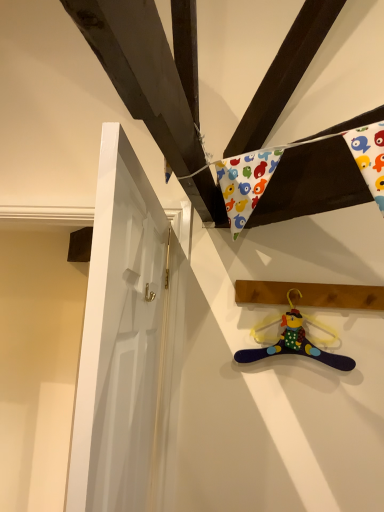
Measure the distance between multicolored fabric hanger at lower right and camera.

A distance of 4.79 feet exists between multicolored fabric hanger at lower right and camera.

At what (x,y) coordinates should I click in order to perform the action: click on multicolored fabric hanger at lower right. Please return your answer as a coordinate pair (x, y). Looking at the image, I should click on (267, 329).

Image resolution: width=384 pixels, height=512 pixels. Identify the location of wooden plank at upper right. (310, 294).

Between multicolored fabric hanger at lower right and multicolored fabric hanger at lower right, which one has less height?

multicolored fabric hanger at lower right.

Is multicolored fabric hanger at lower right a part of multicolored fabric hanger at lower right?

No, multicolored fabric hanger at lower right does not contain multicolored fabric hanger at lower right.

From a real-world perspective, between multicolored fabric hanger at lower right and multicolored fabric hanger at lower right, who is vertically higher?

From a 3D spatial view, multicolored fabric hanger at lower right is above.

Considering the positions of point (274, 322) and point (304, 348), is point (274, 322) closer or farther from the camera than point (304, 348)?

Point (274, 322) is positioned farther from the camera compared to point (304, 348).

Is multicolored fabric hanger at lower right located outside multicolored fabric hanger at lower right?

Yes, multicolored fabric hanger at lower right is outside of multicolored fabric hanger at lower right.

Does multicolored fabric hanger at lower right have a greater height compared to multicolored fabric hanger at lower right?

Incorrect, the height of multicolored fabric hanger at lower right is not larger of that of multicolored fabric hanger at lower right.

Is wooden plank at upper right located within multicolored fabric hanger at lower right?

No, wooden plank at upper right is not surrounded by multicolored fabric hanger at lower right.

Looking at this image, is multicolored fabric hanger at lower right touching wooden plank at upper right?

Yes, multicolored fabric hanger at lower right is in contact with wooden plank at upper right.

Considering the relative positions of multicolored fabric hanger at lower right and wooden plank at upper right in the image provided, is multicolored fabric hanger at lower right to the right of wooden plank at upper right from the viewer's perspective?

No.

Can you confirm if multicolored fabric hanger at lower right is positioned to the right of white glossy door at left?

Yes, multicolored fabric hanger at lower right is to the right of white glossy door at left.

Which object is closer to the camera taking this photo, multicolored fabric hanger at lower right or white glossy door at left?

white glossy door at left.

Is multicolored fabric hanger at lower right positioned with its back to white glossy door at left?

No, multicolored fabric hanger at lower right is not facing the opposite direction of white glossy door at left.

Does point (306, 347) come behind point (171, 476)?

No, it is not.

Between multicolored fabric hanger at lower right and white glossy door at left, which one has smaller width?

Thinner between the two is multicolored fabric hanger at lower right.

Does point (314, 340) appear closer or farther from the camera than point (104, 288)?

Point (314, 340) appears to be farther away from the viewer than point (104, 288).

Can you tell me how much multicolored fabric hanger at lower right and white glossy door at left differ in facing direction?

multicolored fabric hanger at lower right and white glossy door at left are facing 81 degrees away from each other.

Is multicolored fabric hanger at lower right facing away from white glossy door at left?

multicolored fabric hanger at lower right does not have its back to white glossy door at left.

Based on the photo, is wooden plank at upper right not near multicolored fabric hanger at lower right?

wooden plank at upper right is near multicolored fabric hanger at lower right, not far away.

Is wooden plank at upper right positioned in front of multicolored fabric hanger at lower right?

No, wooden plank at upper right is behind multicolored fabric hanger at lower right.

Which of these two, wooden plank at upper right or multicolored fabric hanger at lower right, is smaller?

multicolored fabric hanger at lower right.

Is wooden plank at upper right far from multicolored fabric hanger at lower right?

No, wooden plank at upper right is in close proximity to multicolored fabric hanger at lower right.

Considering the positions of point (342, 296) and point (294, 296), is point (342, 296) closer or farther from the camera than point (294, 296)?

Point (342, 296).

Consider the image. Would you say wooden plank at upper right is inside or outside multicolored fabric hanger at lower right?

The correct answer is: outside.

Visually, is wooden plank at upper right positioned to the left or to the right of multicolored fabric hanger at lower right?

In the image, wooden plank at upper right appears on the right side of multicolored fabric hanger at lower right.

In order to click on toy in front of the multicolored fabric hanger at lower right in this screenshot , I will do `click(293, 337)`.

In the image, there is a multicolored fabric hanger at lower right. At what (x,y) coordinates should I click in order to perform the action: click on toy below it (from the image's perspective). Please return your answer as a coordinate pair (x, y). The height and width of the screenshot is (512, 384). Looking at the image, I should click on (293, 337).

Consider the image. Considering their positions, is multicolored fabric hanger at lower right positioned closer to multicolored fabric hanger at lower right than wooden plank at upper right?

The object closer to multicolored fabric hanger at lower right is multicolored fabric hanger at lower right.

Estimate the real-world distances between objects in this image. Which object is further from wooden plank at upper right, multicolored fabric hanger at lower right or white glossy door at left?

Among the two, white glossy door at left is located further to wooden plank at upper right.

Based on their spatial positions, is multicolored fabric hanger at lower right or white glossy door at left closer to multicolored fabric hanger at lower right?

multicolored fabric hanger at lower right lies closer to multicolored fabric hanger at lower right than the other object.

Considering their positions, is multicolored fabric hanger at lower right positioned further to multicolored fabric hanger at lower right than white glossy door at left?

white glossy door at left is positioned further to the anchor multicolored fabric hanger at lower right.

Which object lies nearer to the anchor point multicolored fabric hanger at lower right, wooden plank at upper right or multicolored fabric hanger at lower right?

Among the two, multicolored fabric hanger at lower right is located nearer to multicolored fabric hanger at lower right.

From the image, which object appears to be farther from multicolored fabric hanger at lower right, white glossy door at left or wooden plank at upper right?

Based on the image, white glossy door at left appears to be further to multicolored fabric hanger at lower right.

From the image, which object appears to be farther from wooden plank at upper right, multicolored fabric hanger at lower right or white glossy door at left?

white glossy door at left is positioned further to the anchor wooden plank at upper right.

Estimate the real-world distances between objects in this image. Which object is closer to white glossy door at left, multicolored fabric hanger at lower right or wooden plank at upper right?

The object closer to white glossy door at left is multicolored fabric hanger at lower right.

This screenshot has width=384, height=512. What are the coordinates of `hanger between wooden plank at upper right and multicolored fabric hanger at lower right from top to bottom` in the screenshot? It's located at (267, 329).

This screenshot has height=512, width=384. Identify the location of toy positioned between white glossy door at left and multicolored fabric hanger at lower right from near to far. (293, 337).

You are a GUI agent. You are given a task and a screenshot of the screen. Output one action in this format:
    pyautogui.click(x=<x>, y=<y>)
    Task: Click on the plank between white glossy door at left and multicolored fabric hanger at lower right in the front-back direction
    
    Given the screenshot: What is the action you would take?
    pyautogui.click(x=310, y=294)

You are a GUI agent. You are given a task and a screenshot of the screen. Output one action in this format:
    pyautogui.click(x=<x>, y=<y>)
    Task: Click on the toy positioned between white glossy door at left and wooden plank at upper right from near to far
    
    Given the screenshot: What is the action you would take?
    pyautogui.click(x=293, y=337)